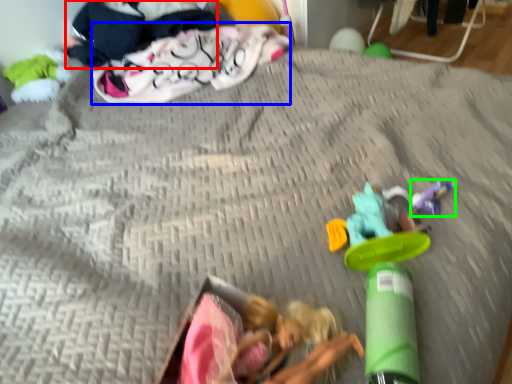
Question: Which object is positioned closest to clothing (highlighted by a red box)? Select from clothing (highlighted by a blue box) and toy (highlighted by a green box).

Choices:
 (A) clothing
 (B) toy

Answer: (A)